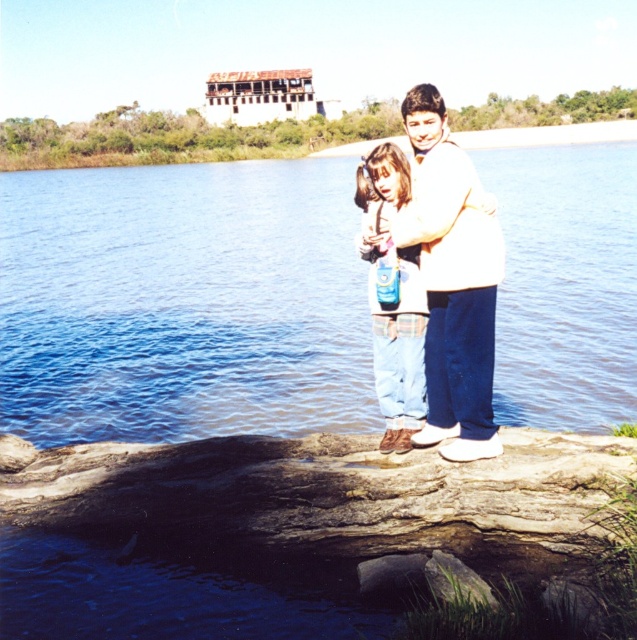
You are a photographer standing at the edge of the lake. You want to take a photo of the white cotton sweater at center and denim pants at center. Which object will appear closer to the camera in the photo?

The white cotton sweater at center will appear closer to the camera because it is in front of the denim pants at center.

You are a photographer taking a picture of the blue liquid water at center and the denim pants at center. Which object is closer to the camera lens?

The blue liquid water at center is positioned over denim pants at center, meaning it is closer to the camera lens.